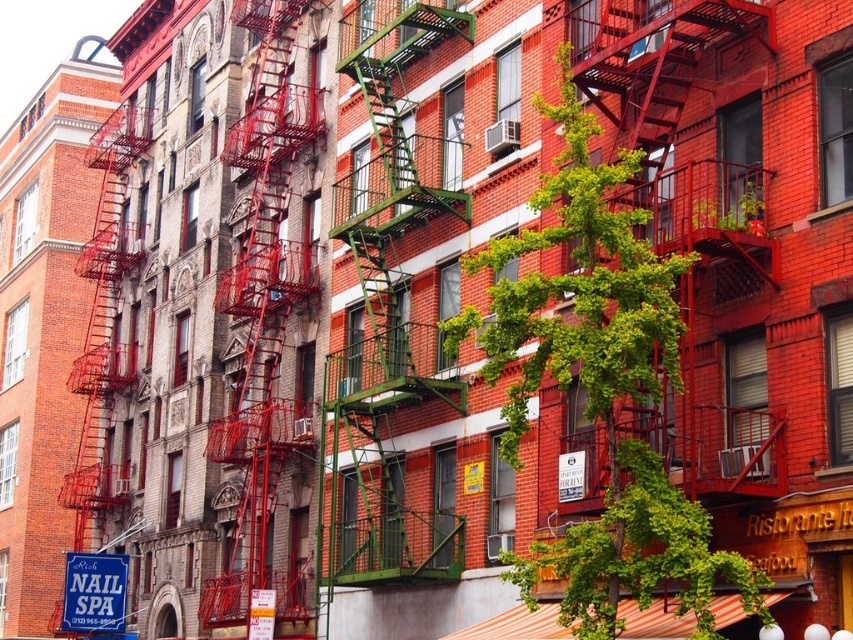
Question: Is metallic red fire escape at left further to camera compared to blue plastic sign at lower left?

Choices:
 (A) no
 (B) yes

Answer: (A)

Question: Is metallic red fire escape at left bigger than blue plastic sign at lower left?

Choices:
 (A) yes
 (B) no

Answer: (A)

Question: Which point appears closest to the camera in this image?

Choices:
 (A) (215, 609)
 (B) (387, 230)
 (C) (113, 604)

Answer: (B)

Question: Among these objects, which one is farthest from the camera?

Choices:
 (A) metallic red fire escape at left
 (B) blue plastic sign at lower left
 (C) green metal fire escape at center

Answer: (B)

Question: Which point is farther to the camera?

Choices:
 (A) blue plastic sign at lower left
 (B) green metal fire escape at center

Answer: (A)

Question: In this image, where is green metal fire escape at center located relative to metallic red fire escape at left?

Choices:
 (A) below
 (B) above

Answer: (B)